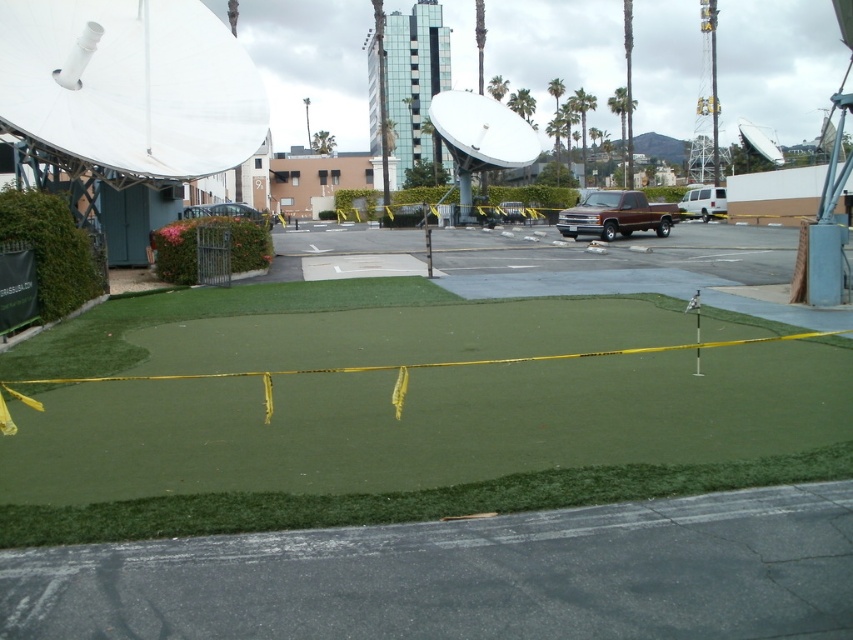
Question: Which of these objects is positioned closest to the metallic silver car at center?

Choices:
 (A) brown matte truck at center
 (B) white van at center
 (C) green artificial turf at center
 (D) green leafy palm tree at upper center

Answer: (A)

Question: Can you confirm if white metallic satellite at center is positioned to the left of white van at center?

Choices:
 (A) yes
 (B) no

Answer: (A)

Question: Estimate the real-world distances between objects in this image. Which object is farther from the white van at center?

Choices:
 (A) metallic silver car at center
 (B) green artificial turf at center

Answer: (B)

Question: Can you confirm if brown matte truck at center is positioned to the right of green leafy palm tree at upper center?

Choices:
 (A) no
 (B) yes

Answer: (A)

Question: From the image, what is the correct spatial relationship of green artificial turf at center in relation to white metallic satellite at center?

Choices:
 (A) left
 (B) right

Answer: (A)

Question: Among these objects, which one is farthest from the camera?

Choices:
 (A) green artificial turf at center
 (B) metallic silver car at center
 (C) white van at center
 (D) green leafy palm tree at upper center

Answer: (D)